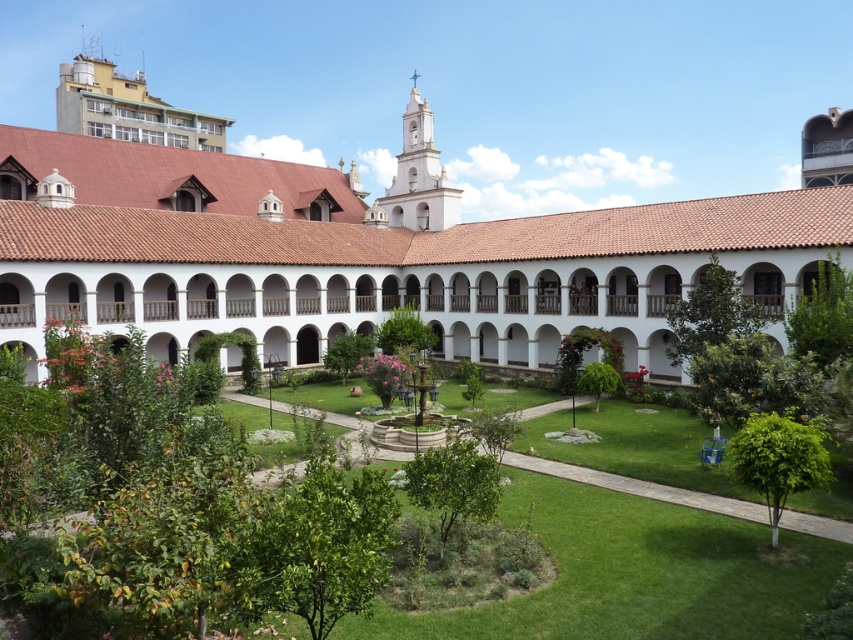
Question: Does white stucco building at center appear on the right side of green grass at center?

Choices:
 (A) yes
 (B) no

Answer: (B)

Question: From the image, what is the correct spatial relationship of white stucco building at center in relation to green grass at center?

Choices:
 (A) above
 (B) below

Answer: (A)

Question: Among these points, which one is nearest to the camera?

Choices:
 (A) (670, 621)
 (B) (210, 184)

Answer: (A)

Question: In this image, where is white stucco building at center located relative to green grass at center?

Choices:
 (A) below
 (B) above

Answer: (B)

Question: Which object is closer to the camera taking this photo?

Choices:
 (A) white stucco building at center
 (B) green grass at center

Answer: (B)